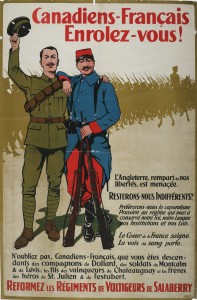
In order to click on coat in this screenshot , I will do `click(97, 147)`, `click(70, 138)`, `click(85, 98)`, `click(62, 72)`, `click(99, 105)`, `click(110, 98)`.